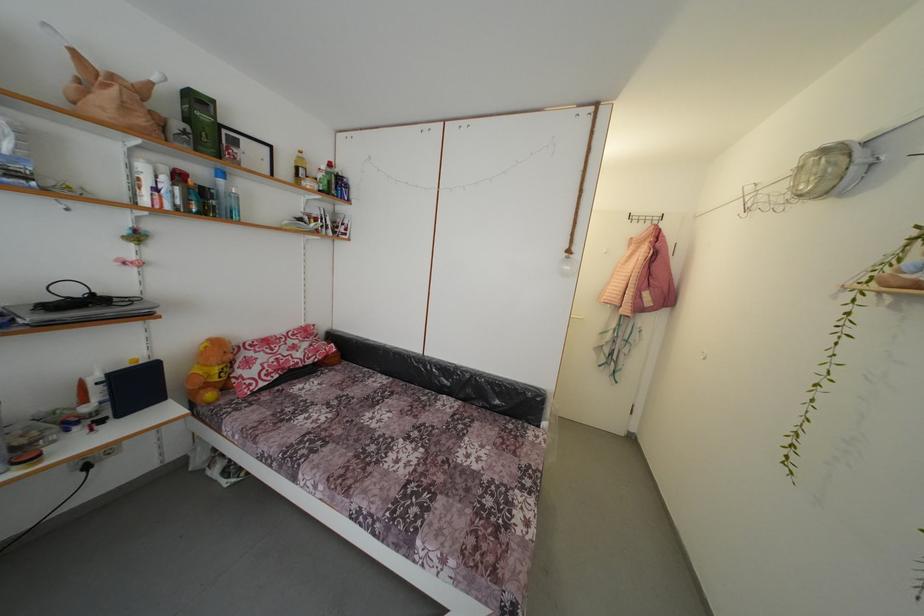
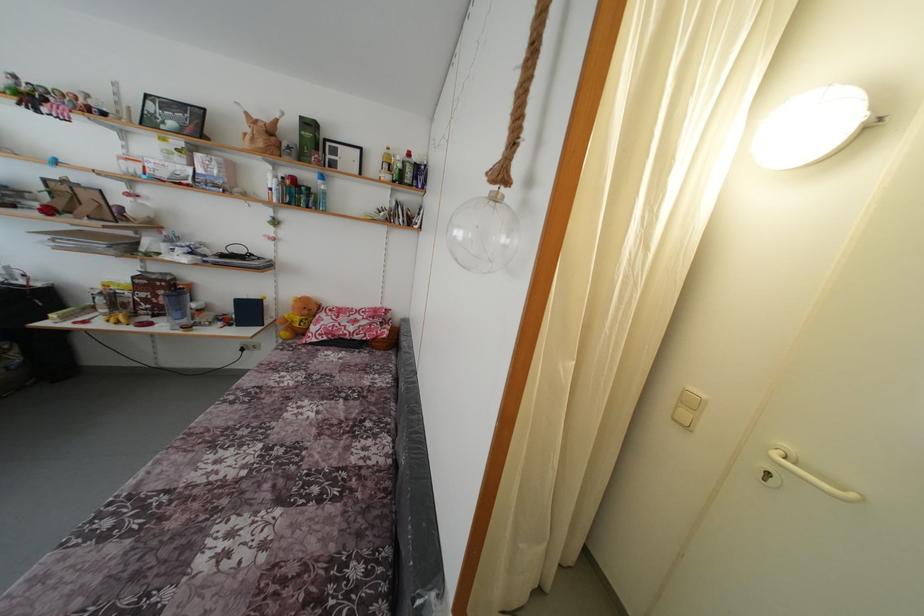
The point at (261,358) is marked in the first image. Where is the corresponding point in the second image?

(332, 321)